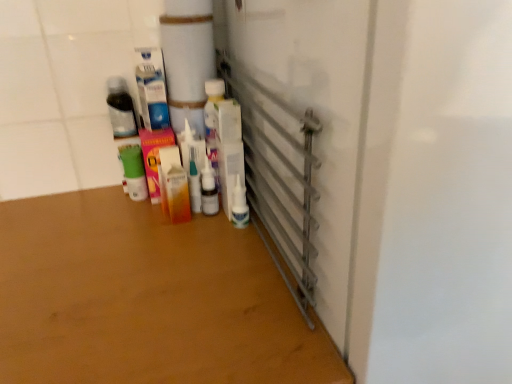
Describe the element at coordinates (146, 299) in the screenshot. The height and width of the screenshot is (384, 512). I see `brown wood counter top at center` at that location.

Find the location of a particular element. The height and width of the screenshot is (384, 512). brown wood counter top at center is located at coordinates (146, 299).

Where is `brown wood counter top at center`? The image size is (512, 384). brown wood counter top at center is located at coordinates (146, 299).